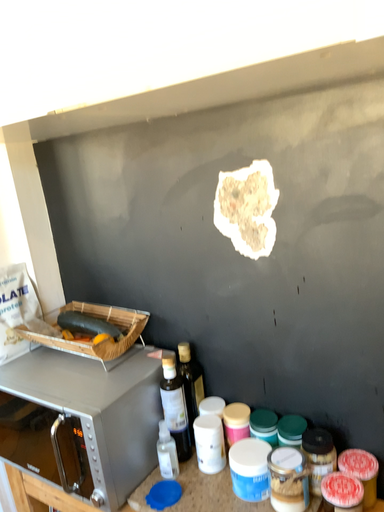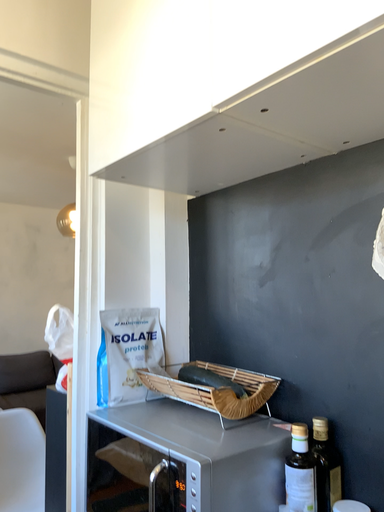
Question: How did the camera likely rotate when shooting the video?

Choices:
 (A) rotated upward
 (B) rotated downward

Answer: (A)